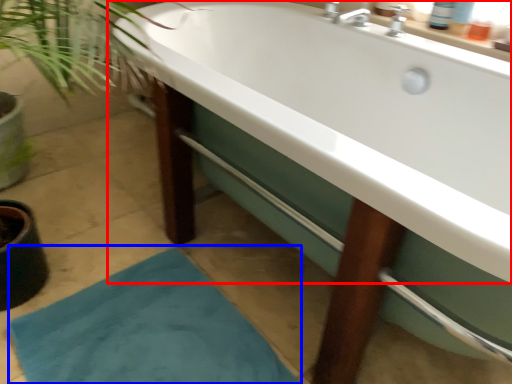
Question: Which of the following is the farthest to the observer, bathtub (highlighted by a red box) or bath mat (highlighted by a blue box)?

Choices:
 (A) bathtub
 (B) bath mat

Answer: (B)